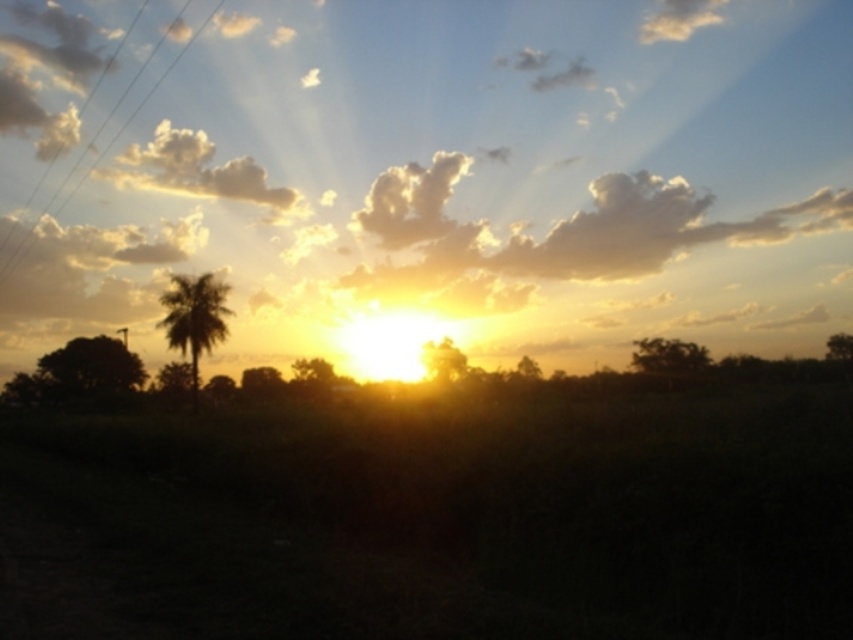
Question: Which point is closer to the camera?

Choices:
 (A) white fluffy cloud at upper center
 (B) silhouette leafy palm at left
 (C) white fluffy cloud at upper left

Answer: (B)

Question: Is white fluffy cloud at upper left in front of silhouette leafy palm at left?

Choices:
 (A) yes
 (B) no

Answer: (B)

Question: Is white fluffy cloud at upper left smaller than silhouette leafy palm at left?

Choices:
 (A) no
 (B) yes

Answer: (A)

Question: Among these points, which one is nearest to the camera?

Choices:
 (A) (196, 372)
 (B) (421, 224)

Answer: (A)

Question: Which point is farther from the camera taking this photo?

Choices:
 (A) (126, 147)
 (B) (194, 282)
 (C) (386, 224)

Answer: (A)

Question: Does white fluffy cloud at upper center appear on the right side of silhouette leafy palm at left?

Choices:
 (A) no
 (B) yes

Answer: (B)